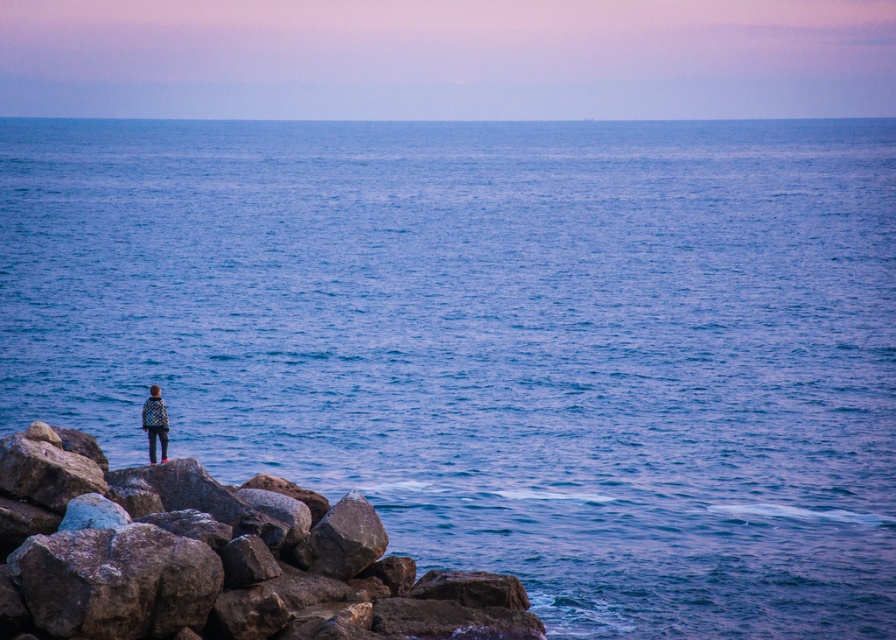
Between point (14, 576) and point (157, 426), which one is positioned in front?

Positioned in front is point (14, 576).

Who is shorter, rough textured rock at lower left or checkered fabric jacket at lower left?

rough textured rock at lower left

Which is behind, point (50, 532) or point (154, 458)?

The point (154, 458) is more distant.

You are a GUI agent. You are given a task and a screenshot of the screen. Output one action in this format:
    pyautogui.click(x=<x>, y=<y>)
    Task: Click on the rough textured rock at lower left
    
    Given the screenshot: What is the action you would take?
    pyautogui.click(x=214, y=560)